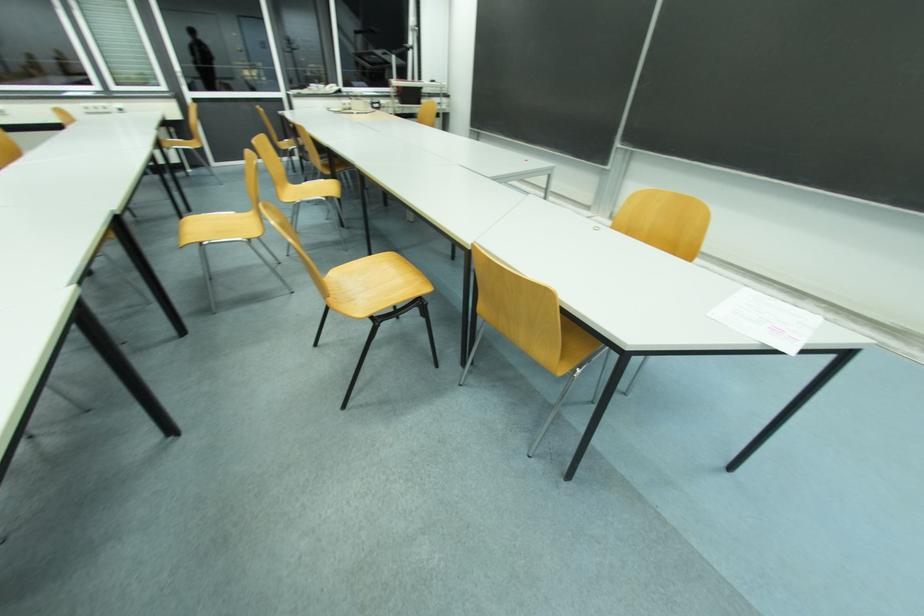
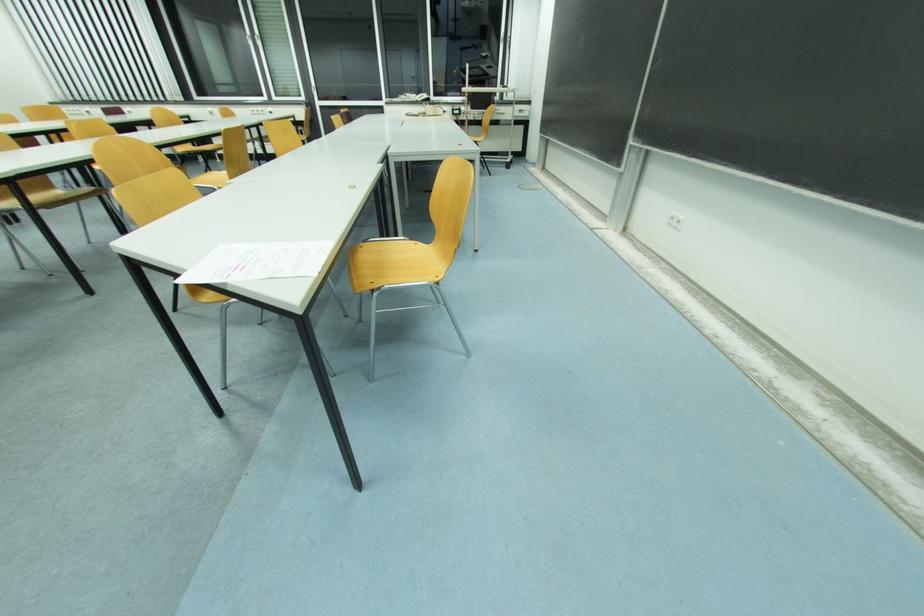
Question: In a continuous first-person perspective shot, in which direction is the camera moving?

Choices:
 (A) Left
 (B) Right
 (C) Forward
 (D) Backward

Answer: (B)